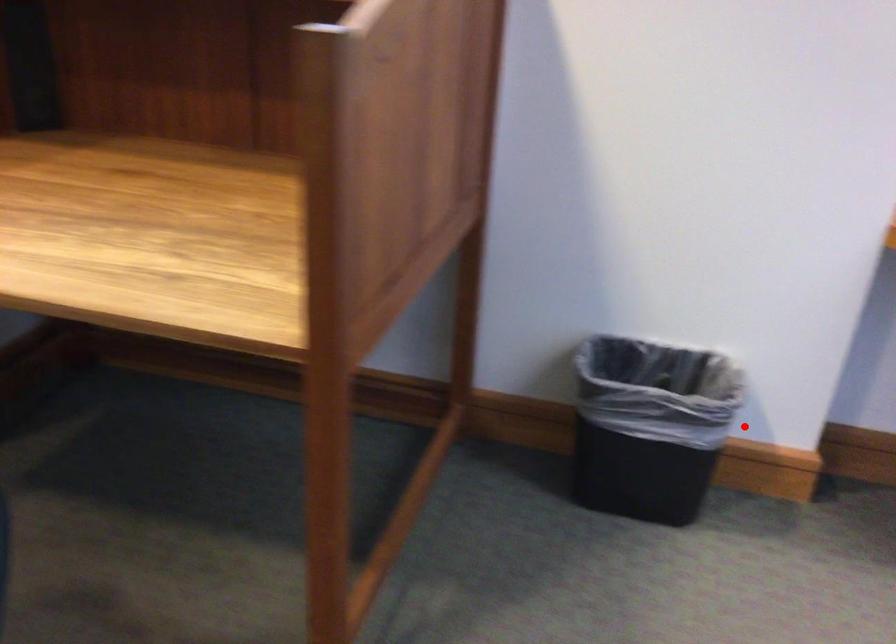
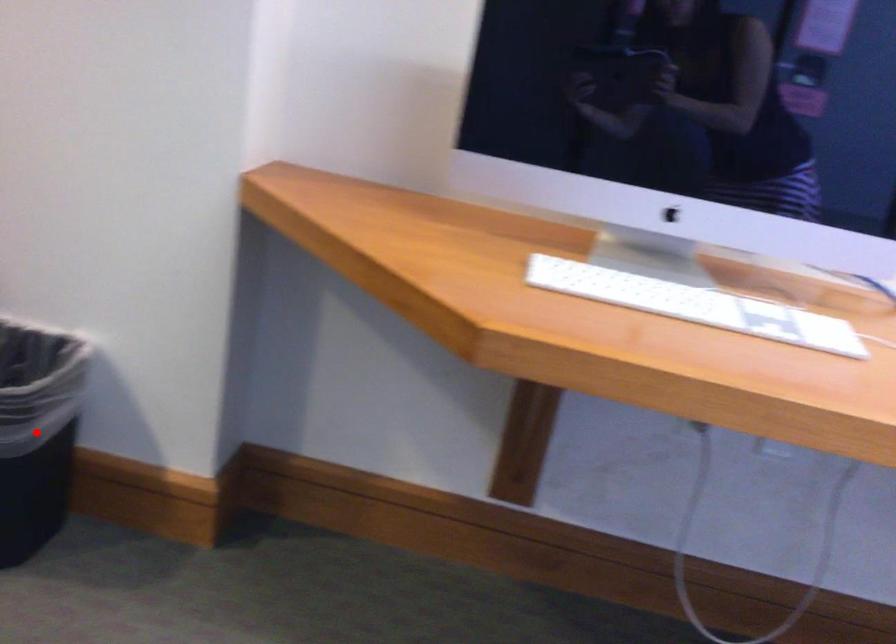
I am providing you with two images of the same scene from different viewpoints. A red point is marked on the first image and another point is marked on the second image. Does the point marked in image1 correspond to the same location as the one in image2?

Yes